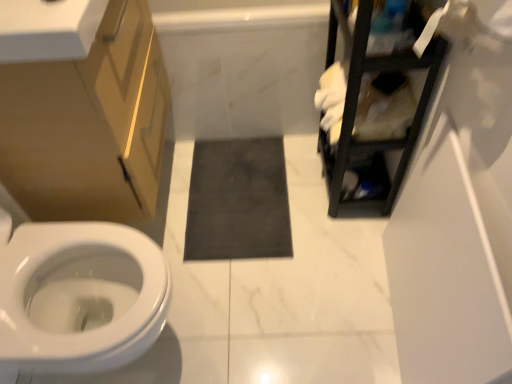
Question: From a real-world perspective, is white glossy countertop at upper left physically located above or below black metal shelving unit at upper right?

Choices:
 (A) below
 (B) above

Answer: (B)

Question: From the image's perspective, is white glossy countertop at upper left positioned above or below black metal shelving unit at upper right?

Choices:
 (A) above
 (B) below

Answer: (A)

Question: Estimate the real-world distances between objects in this image. Which object is closer to the dark gray matte bath mat at center?

Choices:
 (A) white glossy countertop at upper left
 (B) matte gold cabinet at left
 (C) black metal shelving unit at upper right
 (D) white marble bath at center

Answer: (D)

Question: Which object is positioned farthest from the dark gray matte bath mat at center?

Choices:
 (A) white marble bath at center
 (B) matte gold cabinet at left
 (C) black metal shelving unit at upper right
 (D) white glossy countertop at upper left

Answer: (D)